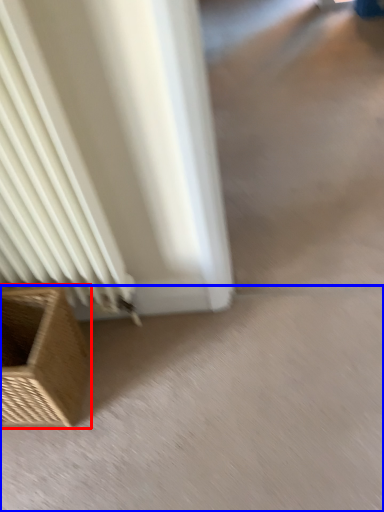
Question: Which point is closer to the camera, furniture (highlighted by a red box) or concrete (highlighted by a blue box)?

Choices:
 (A) furniture
 (B) concrete

Answer: (A)